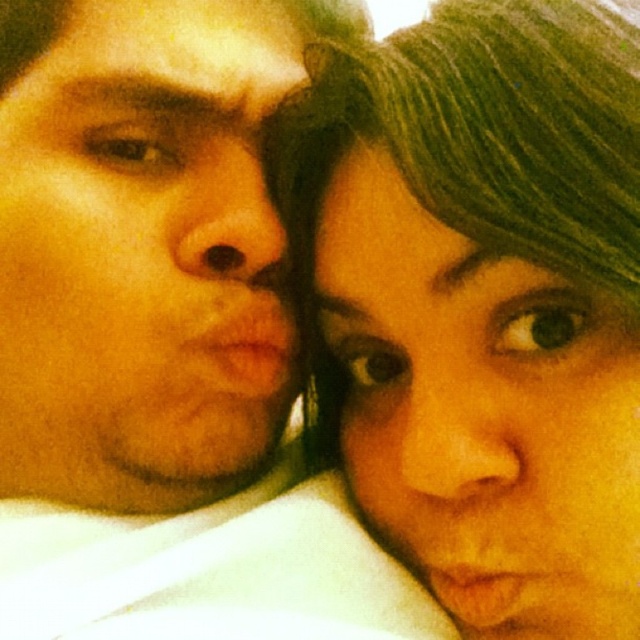
Question: Is matte skin face at left below green matte hair at upper right?

Choices:
 (A) no
 (B) yes

Answer: (A)

Question: Which point appears farthest from the camera in this image?

Choices:
 (A) (115, 80)
 (B) (618, 460)

Answer: (A)

Question: Is matte skin face at left to the left of green matte hair at upper right from the viewer's perspective?

Choices:
 (A) no
 (B) yes

Answer: (B)

Question: Does matte skin face at left have a greater width compared to green matte hair at upper right?

Choices:
 (A) no
 (B) yes

Answer: (B)

Question: Which point is farther to the camera?

Choices:
 (A) matte skin face at left
 (B) green matte hair at upper right

Answer: (A)